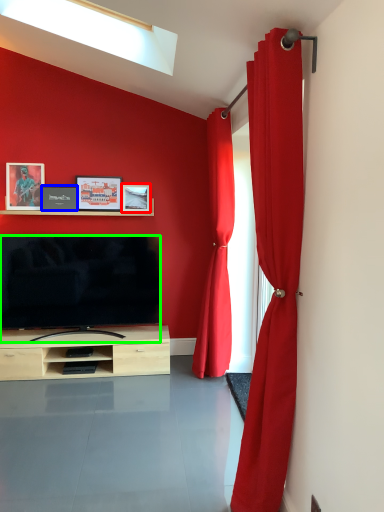
Question: Considering the real-world distances, which object is farthest from picture frame (highlighted by a red box)? picture frame (highlighted by a blue box) or television (highlighted by a green box)?

Choices:
 (A) picture frame
 (B) television

Answer: (B)